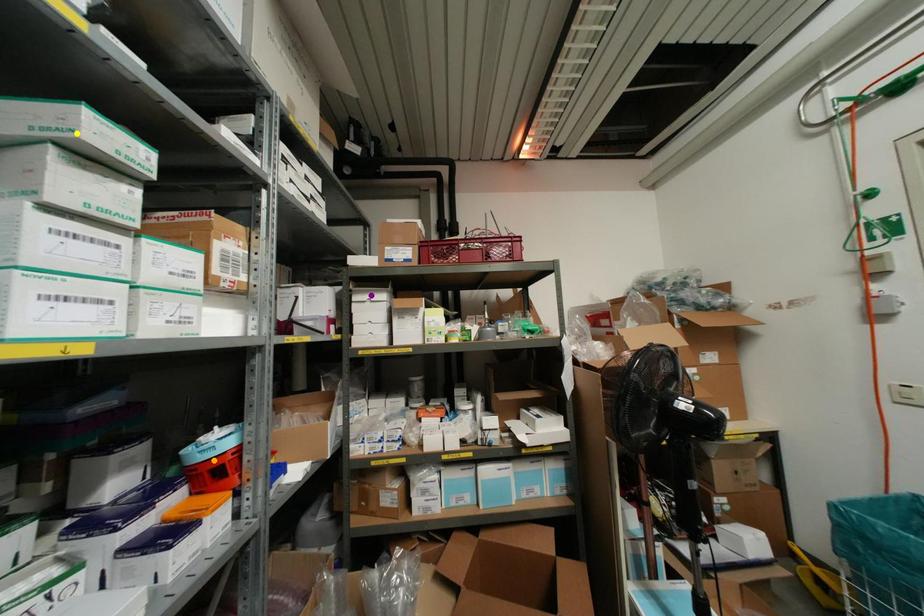
Order these from nearest to farthest:
yellow point
purple point
orange point

purple point, orange point, yellow point